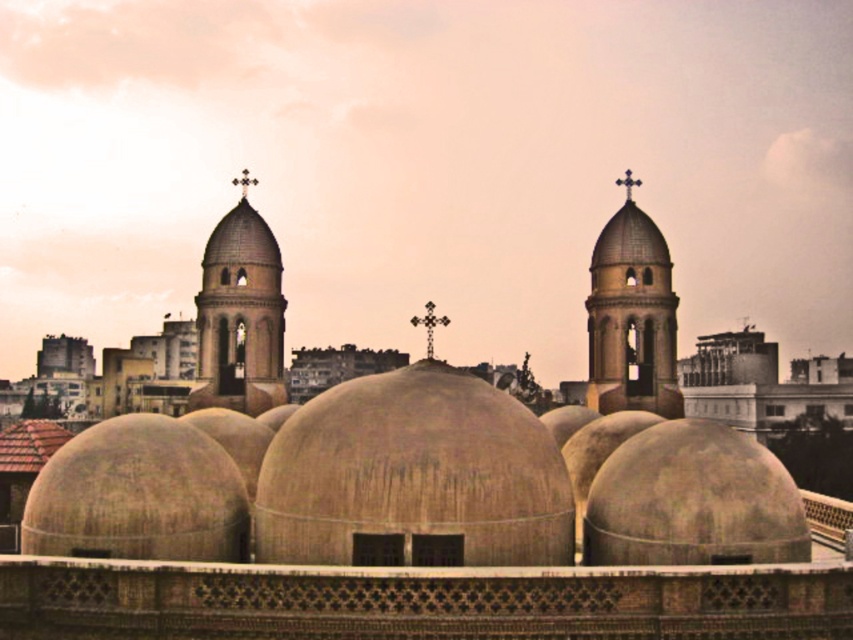
Question: Which of the following is the farthest from the observer?

Choices:
 (A) (672, 538)
 (B) (633, 438)
 (C) (424, 452)

Answer: (B)

Question: Which point appears closest to the camera in this image?

Choices:
 (A) (434, 369)
 (B) (595, 515)

Answer: (B)

Question: Considering the relative positions of beige concrete domes at center and matte concrete dome at center in the image provided, where is beige concrete domes at center located with respect to matte concrete dome at center?

Choices:
 (A) left
 (B) right

Answer: (A)

Question: Estimate the real-world distances between objects in this image. Which object is closer to the matte concrete dome at center?

Choices:
 (A) beige concrete domes at center
 (B) beige concrete dome at center

Answer: (B)

Question: Is beige concrete domes at center below beige concrete dome at center?

Choices:
 (A) yes
 (B) no

Answer: (B)

Question: From the image, what is the correct spatial relationship of beige concrete domes at center in relation to matte concrete dome at center?

Choices:
 (A) right
 (B) left

Answer: (B)